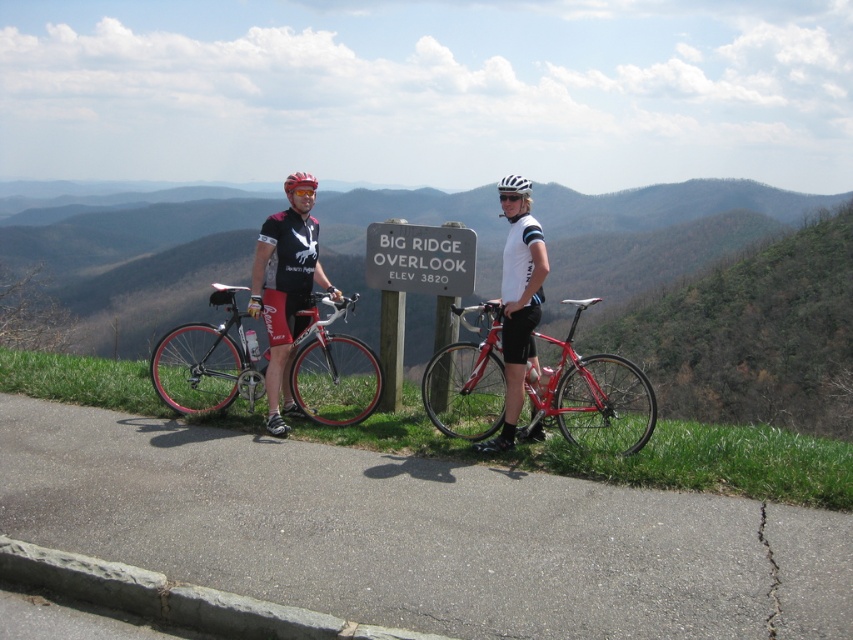
Is shiny red bicycle at center to the left of shiny metallic bicycle at center from the viewer's perspective?

No, shiny red bicycle at center is not to the left of shiny metallic bicycle at center.

Between shiny red bicycle at center and shiny metallic bicycle at center, which one appears on the right side from the viewer's perspective?

From the viewer's perspective, shiny red bicycle at center appears more on the right side.

In order to click on shiny red bicycle at center in this screenshot , I will do `click(595, 396)`.

Which of these two, shiny red bicycle at center or matte black helmet at center, stands shorter?

Standing shorter between the two is shiny red bicycle at center.

Can you confirm if shiny red bicycle at center is positioned below matte black helmet at center?

Yes.

Which is behind, point (529, 397) or point (283, 180)?

Point (283, 180)

This screenshot has width=853, height=640. Identify the location of shiny red bicycle at center. (595, 396).

Does shiny metallic bicycle at center have a greater height compared to matte black helmet at center?

In fact, shiny metallic bicycle at center may be shorter than matte black helmet at center.

In the scene shown: How much distance is there between shiny metallic bicycle at center and matte black helmet at center?

shiny metallic bicycle at center and matte black helmet at center are 6.47 feet apart.

Measure the distance between point (x=328, y=374) and camera.

They are 23.98 feet apart.

This screenshot has width=853, height=640. What are the coordinates of `shiny metallic bicycle at center` in the screenshot? It's located at (206, 362).